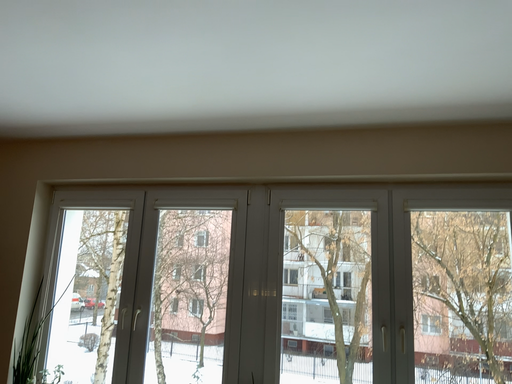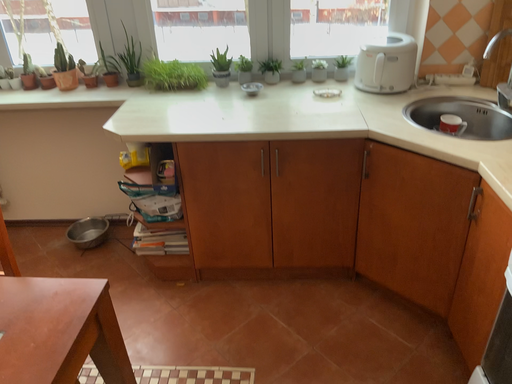
Question: How did the camera likely rotate when shooting the video?

Choices:
 (A) rotated downward
 (B) rotated upward

Answer: (A)